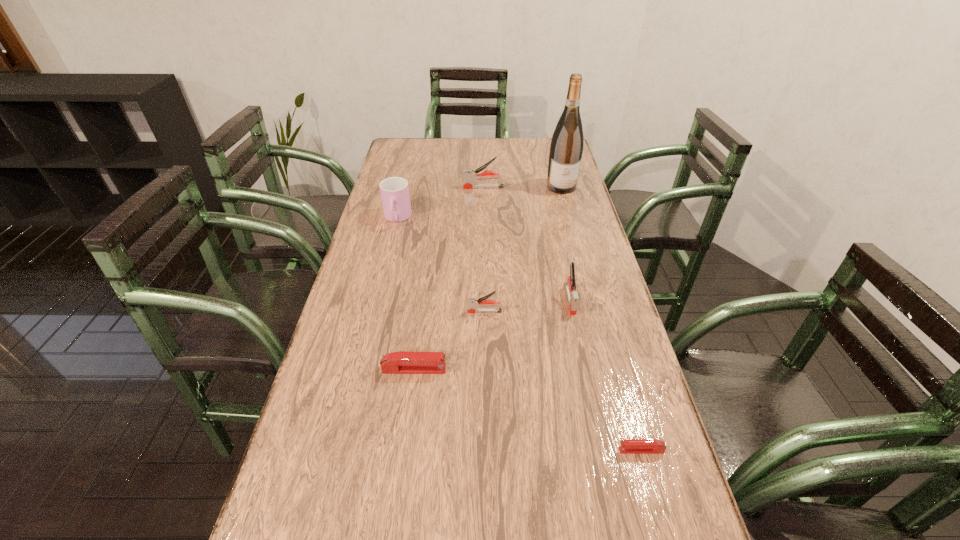
Locate an element on the screen. Image resolution: width=960 pixels, height=540 pixels. the second nearest stapler is located at coordinates (402, 362).

I want to click on the sixth tallest object, so click(x=402, y=362).

The height and width of the screenshot is (540, 960). I want to click on the nearer red stapler, so click(628, 446).

Where is `the nearest object`? the nearest object is located at coordinates click(x=628, y=446).

Locate an element on the screen. This screenshot has height=540, width=960. free space located 0.100m on the label of the wine bottle is located at coordinates (567, 210).

You are a GUI agent. You are given a task and a screenshot of the screen. Output one action in this format:
    pyautogui.click(x=<x>, y=<y>)
    Task: Click on the vacant point located on the handle side of the biggest gray stapler
    The height and width of the screenshot is (540, 960).
    Given the screenshot: What is the action you would take?
    pyautogui.click(x=386, y=187)

Where is `vacant region located on the handle side of the biggest gray stapler`? This screenshot has width=960, height=540. vacant region located on the handle side of the biggest gray stapler is located at coordinates (416, 187).

Where is `vacant space located 0.120m on the handle side of the biggest gray stapler`? vacant space located 0.120m on the handle side of the biggest gray stapler is located at coordinates (431, 187).

This screenshot has height=540, width=960. In order to click on free space located with the handle on the side of the leftmost object in this screenshot , I will do `click(377, 301)`.

Locate an element on the screen. The width and height of the screenshot is (960, 540). vacant space located 0.250m on the handle side of the second smallest gray stapler is located at coordinates (590, 396).